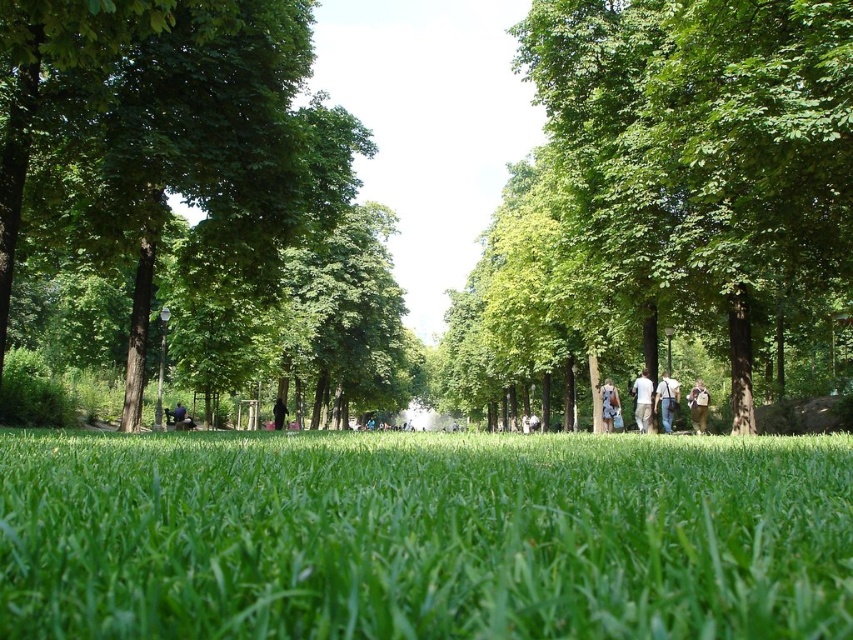
You are an observer standing in the park and see a white cotton shirt at center and a dark blue fabric at center. Which object is bigger in size?

The white cotton shirt at center is larger in size compared to the dark blue fabric at center.